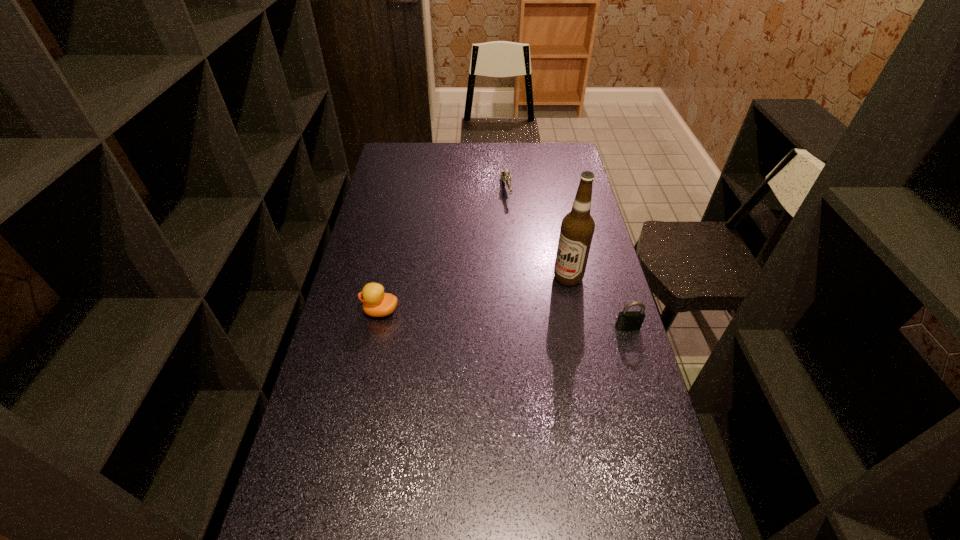
The width and height of the screenshot is (960, 540). I want to click on vacant spot on the desktop that is between the duckling and the nearest object and is positioned on the label of the alcohol, so click(490, 318).

Find the location of a particular element. free space on the desktop that is between the duckling and the padlock and is positioned aimed along the barrel of the third object from right to left is located at coordinates (539, 321).